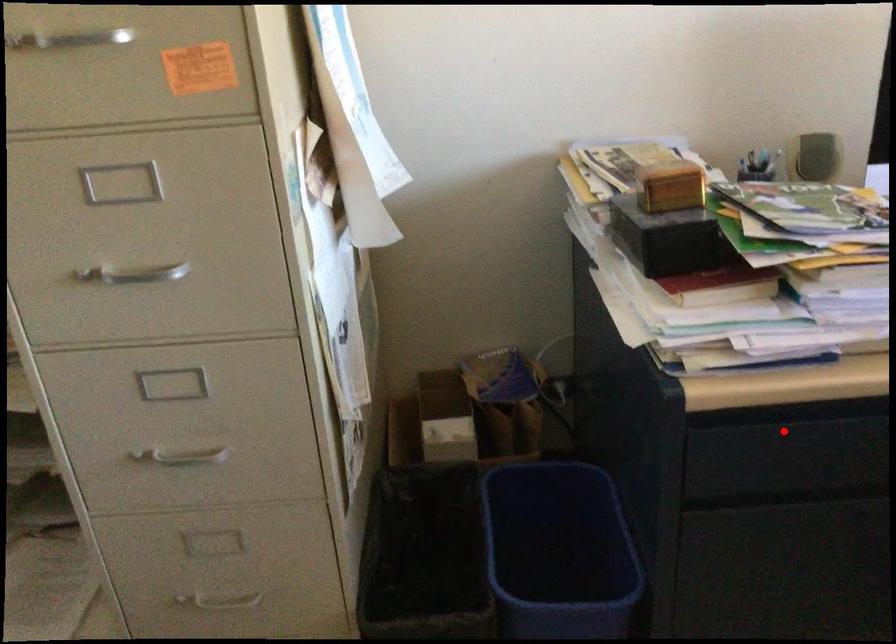
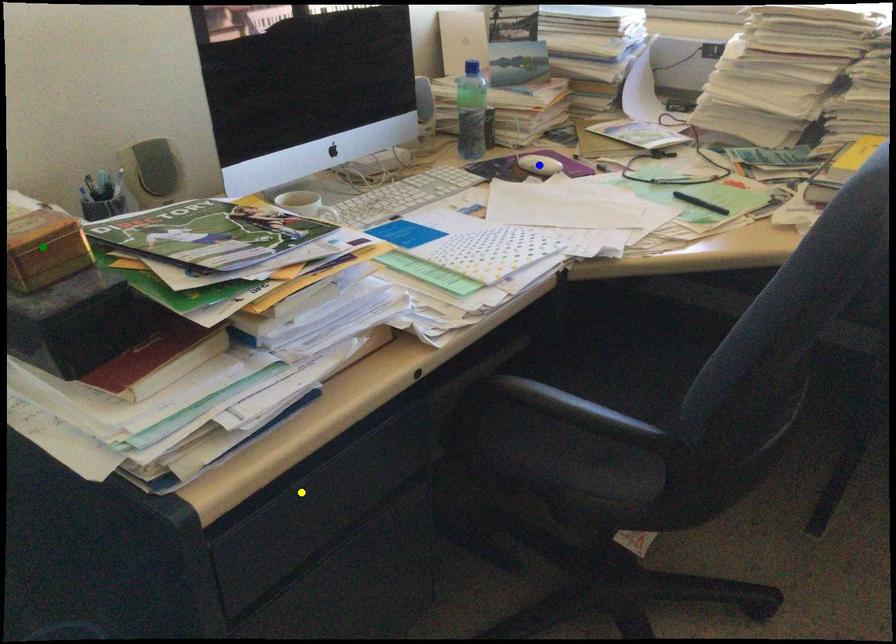
Question: I am providing you with two images of the same scene from different viewpoints. A red point is marked on the first image. You are given multiple points on the second image. Which point in image 2 is actually the same real-world point as the red point in image 1?

Choices:
 (A) yellow point
 (B) green point
 (C) blue point

Answer: (A)